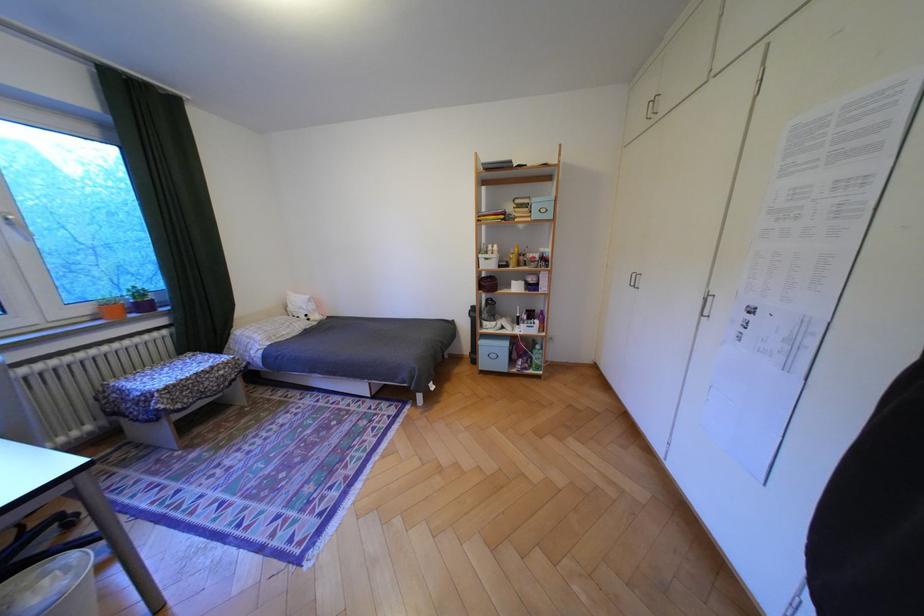
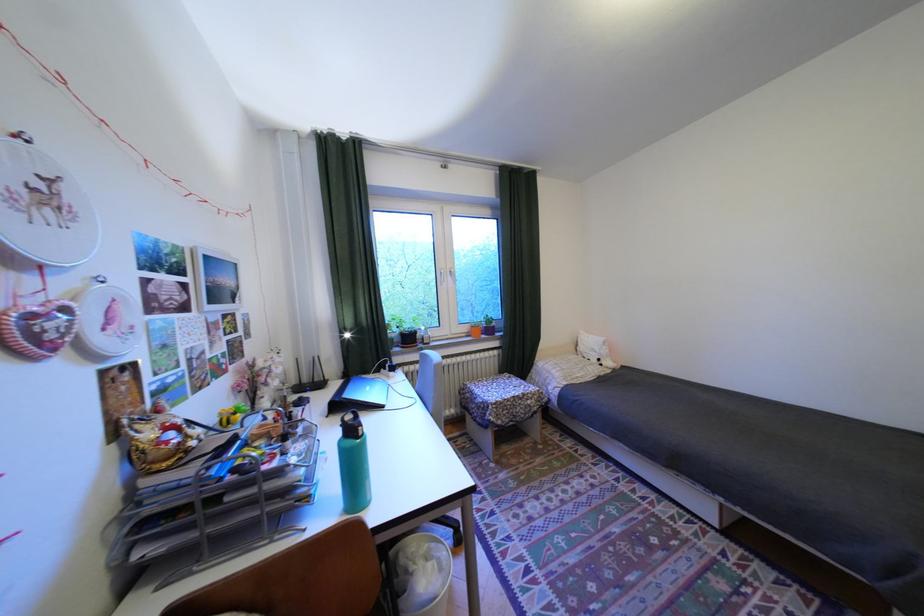
Question: The camera is either moving clockwise (left) or counter-clockwise (right) around the object. The first image is from the beginning of the video and the second image is from the end. Is the camera moving left or right when shooting the video?

Choices:
 (A) Left
 (B) Right

Answer: (B)